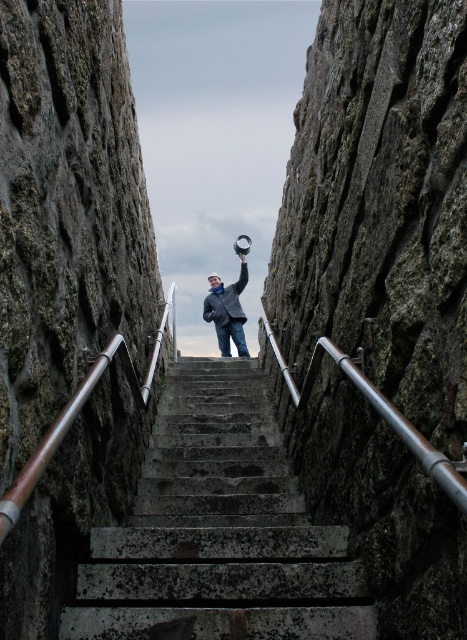
Is satin silver railing at center wider than matte black jacket at center?

No, satin silver railing at center is not wider than matte black jacket at center.

Identify the location of satin silver railing at center. This screenshot has height=640, width=467. (377, 412).

Is point (423, 444) farther from viewer compared to point (216, 282)?

No, it is not.

You are a GUI agent. You are given a task and a screenshot of the screen. Output one action in this format:
    pyautogui.click(x=<x>, y=<y>)
    Task: Click on the satin silver railing at center
    
    Given the screenshot: What is the action you would take?
    pyautogui.click(x=377, y=412)

Does concrete stairs at center have a lesser height compared to matte black jacket at center?

Yes, concrete stairs at center is shorter than matte black jacket at center.

What do you see at coordinates (218, 531) in the screenshot? The image size is (467, 640). I see `concrete stairs at center` at bounding box center [218, 531].

This screenshot has height=640, width=467. Identify the location of concrete stairs at center. (218, 531).

Can you confirm if concrete stairs at center is positioned below satin silver railing at center?

Yes.

Looking at this image, is the position of concrete stairs at center less distant than that of satin silver railing at center?

No, concrete stairs at center is behind satin silver railing at center.

Describe the element at coordinates (218, 531) in the screenshot. I see `concrete stairs at center` at that location.

At what (x,y) coordinates should I click in order to perform the action: click on concrete stairs at center. Please return your answer as a coordinate pair (x, y). Looking at the image, I should click on (218, 531).